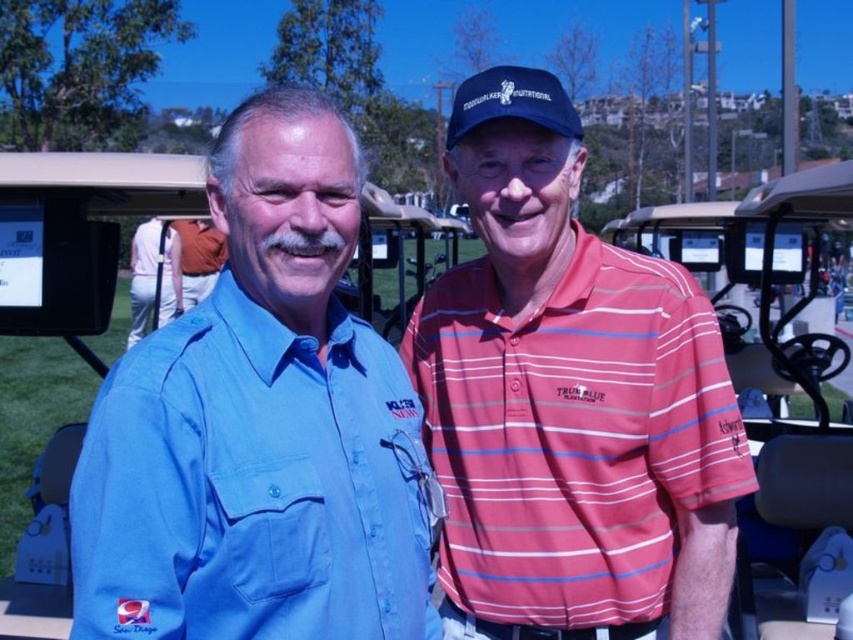
You are a photographer trying to capture a photo of both the matte black baseball cap at center and the white cotton polo shirt at center in the same frame. Given that your camera has a maximum focus range of 10 meters, will you be able to take a clear photo of both objects simultaneously?

The distance between the matte black baseball cap at center and the white cotton polo shirt at center is 9.76 meters, which is within the camera maximum focus range of 10 meters. Therefore, you can take a clear photo of both objects simultaneously.

You are a fashion designer observing two polo shirts in the image. The striped cotton polo shirt at center and the white cotton polo shirt at center. Which one has a smaller width?

The striped cotton polo shirt at center has a smaller width than the white cotton polo shirt at center according to the description.